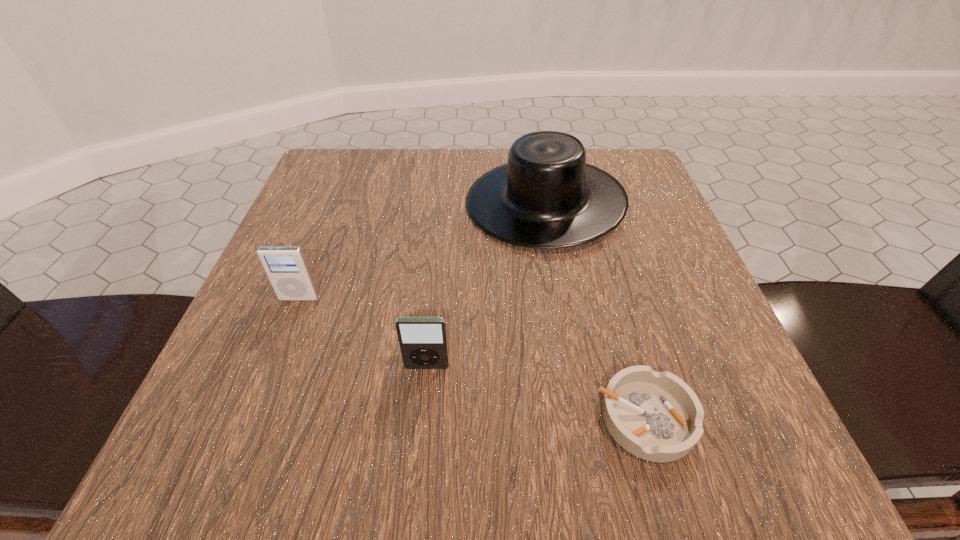
Identify the location of blank space located 0.050m on the front-facing side of the second object from left to right. (423, 402).

Where is `free space located 0.400m on the back of the nearest object`? free space located 0.400m on the back of the nearest object is located at coordinates (586, 208).

The width and height of the screenshot is (960, 540). Find the location of `object that is at the far edge`. object that is at the far edge is located at coordinates (546, 196).

What are the coordinates of `object that is at the near edge` in the screenshot? It's located at (656, 416).

The height and width of the screenshot is (540, 960). In order to click on object that is at the left edge in this screenshot , I will do `click(285, 266)`.

Find the location of a particular element. This screenshot has height=540, width=960. dress hat at the right edge is located at coordinates (546, 196).

Find the location of a particular element. ashtray that is at the right edge is located at coordinates (656, 416).

You are a GUI agent. You are given a task and a screenshot of the screen. Output one action in this format:
    pyautogui.click(x=<x>, y=<y>)
    Task: Click on the object at the far right corner
    
    Given the screenshot: What is the action you would take?
    pyautogui.click(x=546, y=196)

Find the location of `object present at the near right corner`. object present at the near right corner is located at coordinates (656, 416).

Locate an element on the screen. free space at the far edge is located at coordinates (420, 161).